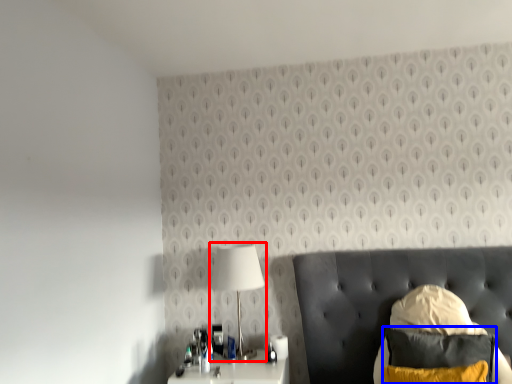
Question: Among these objects, which one is farthest to the camera, lamp (highlighted by a red box) or pillow (highlighted by a blue box)?

Choices:
 (A) lamp
 (B) pillow

Answer: (A)